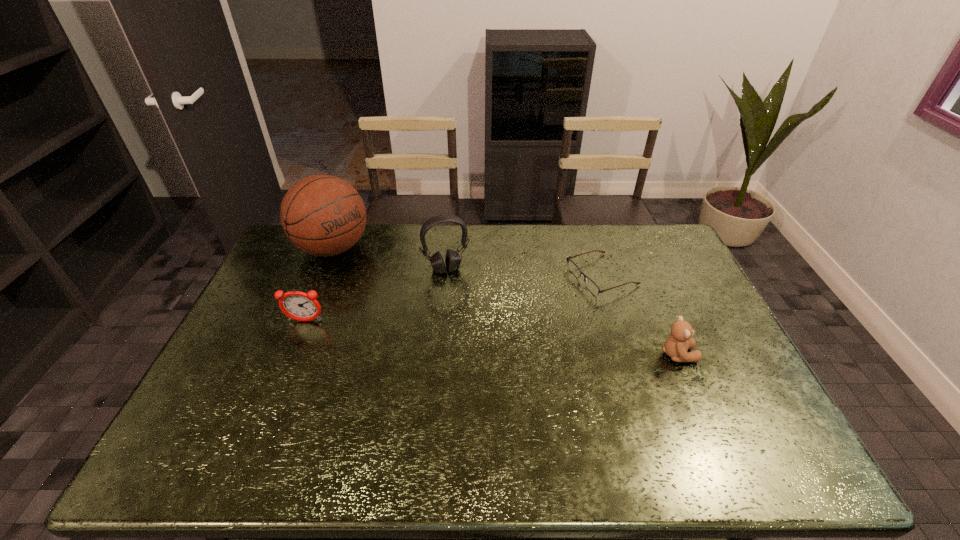
Find the location of a particular element. alarm clock is located at coordinates (300, 306).

The height and width of the screenshot is (540, 960). Find the location of `the nearest object`. the nearest object is located at coordinates (676, 346).

Find the location of a particular element. The image size is (960, 540). headset is located at coordinates (452, 260).

This screenshot has height=540, width=960. Find the location of `the second tallest object`. the second tallest object is located at coordinates (452, 260).

Locate an element on the screen. the tallest object is located at coordinates (323, 215).

Identify the location of the shortest object. (575, 270).

Find the location of a particular element. Image resolution: width=960 pixels, height=540 pixels. vacant area situated 0.340m on the front-facing side of the alarm clock is located at coordinates (261, 429).

Identify the location of free spot located 0.120m on the face of the nearest object. (737, 355).

Where is `vacant space located on the front-facing side of the fourth shortest object`? Image resolution: width=960 pixels, height=540 pixels. vacant space located on the front-facing side of the fourth shortest object is located at coordinates (472, 338).

Find the location of a particular element. The height and width of the screenshot is (540, 960). vacant region located 0.260m on the front-facing side of the fourth shortest object is located at coordinates (470, 333).